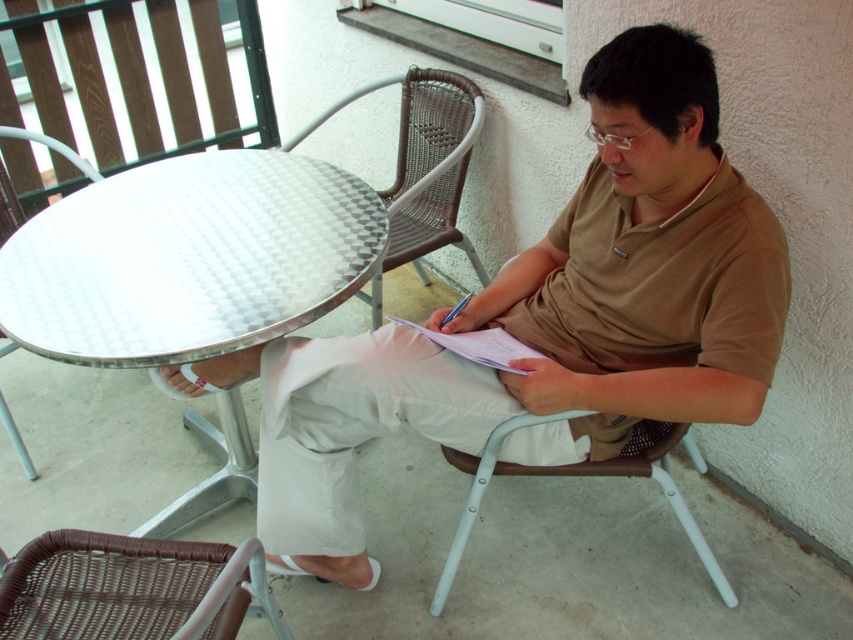
You are a photographer trying to capture a closeup of the matte brown shirt at center and the white paper at center. Since the camera can only focus on one object at a time, which object should you focus on first if you want to ensure the taller object is in focus?

The matte brown shirt at center is much taller than the white paper at center, so you should focus on the matte brown shirt at center first to ensure it is in focus.

You are a delivery person who needs to place a small package on the metallic silver table at center. Based on the coordinates provided, can you confirm if the point marked as point (189,259) is the correct location for the table?

Yes, the point (189,259) indicates the metallic silver table at center, so placing the package there is correct.

You are a guest at a small outdoor gathering and see the metallic silver table at center and the metallic white table at left. Which table is closer to the ground?

The metallic silver table at center is closer to the ground since it is below the metallic white table at left.